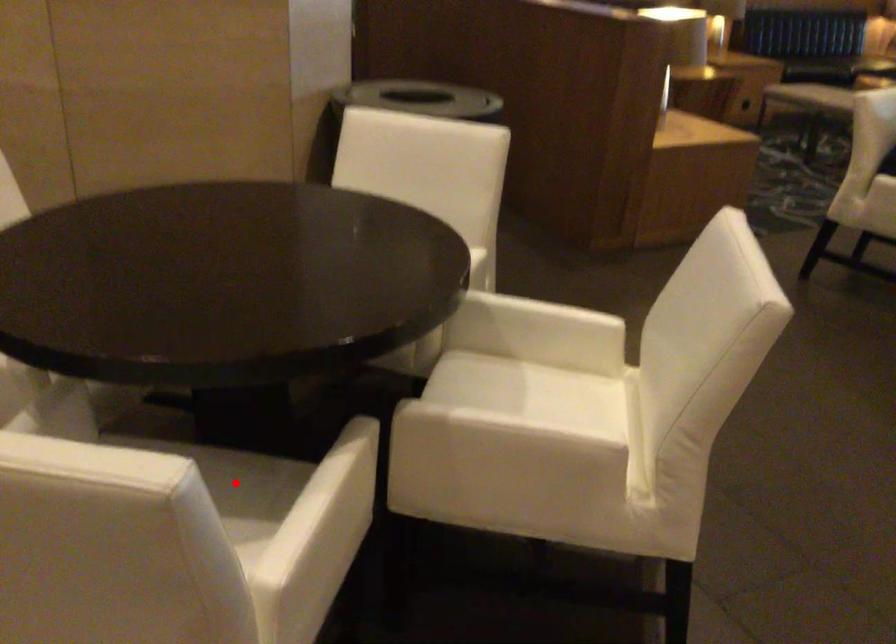
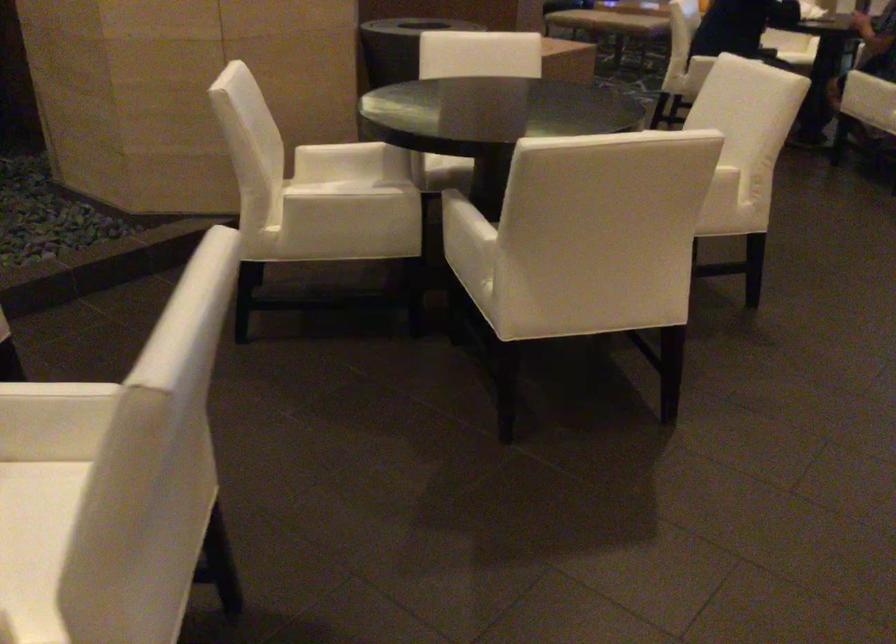
Question: I am providing you with two images of the same scene from different viewpoints. A red point is marked on the first image. Is the red point's position out of view in image 2?

Choices:
 (A) Yes
 (B) No

Answer: (A)